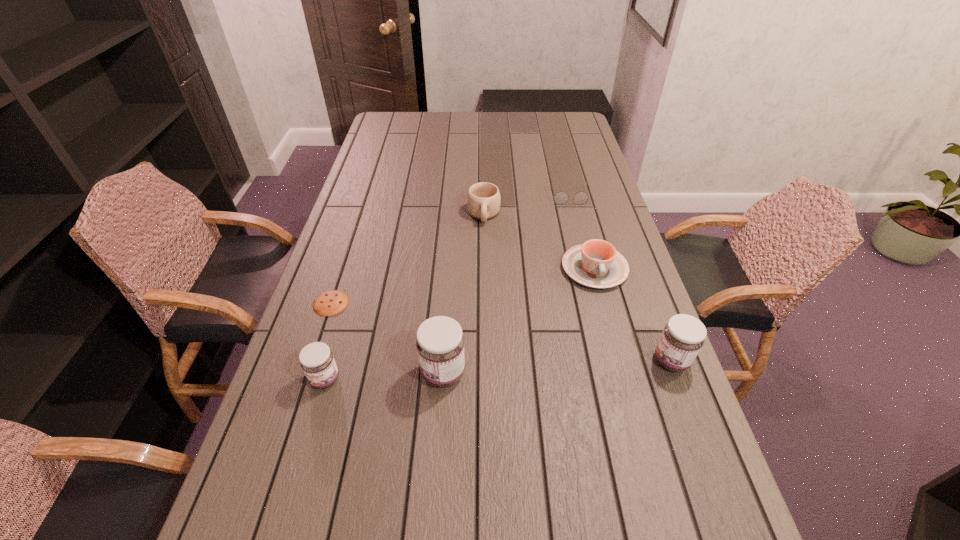
Image resolution: width=960 pixels, height=540 pixels. What are the coordinates of `free space for an extra jam to achieve even spacing` in the screenshot? It's located at point(559,367).